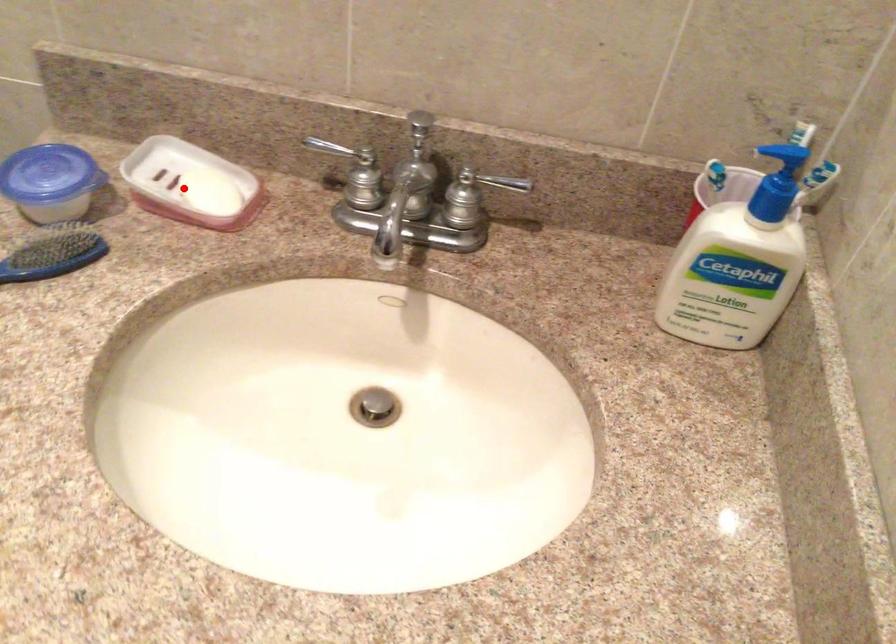
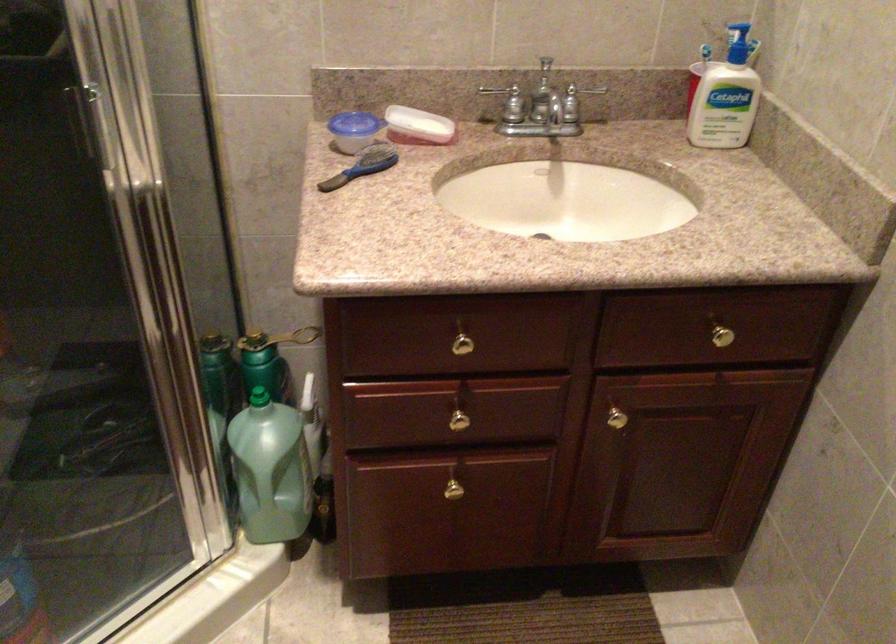
Question: I am providing you with two images of the same scene from different viewpoints. Image1 has a red point marked. In image2, the corresponding 3D location appears at what relative position? Reply with the corresponding letter.

Choices:
 (A) Closer
 (B) Farther

Answer: (B)